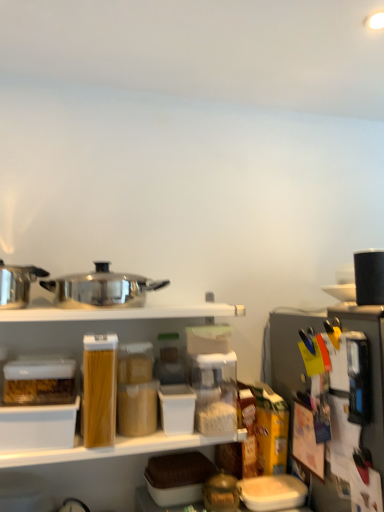
The width and height of the screenshot is (384, 512). What do you see at coordinates (17, 284) in the screenshot?
I see `polished stainless steel pot at left, which ranks as the first appliance in left-to-right order` at bounding box center [17, 284].

Identify the location of metallic silver coffee maker at right, which ranks as the 3th appliance in left-to-right order. (304, 368).

What do you see at coordinates (178, 470) in the screenshot? I see `brown woven basket at center` at bounding box center [178, 470].

At what (x,y) coordinates should I click in order to perform the action: click on polished stainless steel pot at left, marked as the 4th appliance in a right-to-left arrangement. Please return your answer as a coordinate pair (x, y). The width and height of the screenshot is (384, 512). Looking at the image, I should click on (17, 284).

Considering the relative positions of metallic silver coffee maker at right, which ranks as the 3th appliance in left-to-right order, and white plastic shelf at upper center in the image provided, is metallic silver coffee maker at right, which ranks as the 3th appliance in left-to-right order, to the left of white plastic shelf at upper center from the viewer's perspective?

Incorrect, metallic silver coffee maker at right, which ranks as the 3th appliance in left-to-right order, is not on the left side of white plastic shelf at upper center.

Is metallic silver coffee maker at right, the second appliance positioned from the right, not near white plastic shelf at upper center?

No, metallic silver coffee maker at right, the second appliance positioned from the right, is in close proximity to white plastic shelf at upper center.

Is metallic silver coffee maker at right, the second appliance positioned from the right, in front of or behind white plastic shelf at upper center in the image?

Clearly, metallic silver coffee maker at right, the second appliance positioned from the right, is in front of white plastic shelf at upper center.

From the image's perspective, would you say metallic silver coffee maker at right, the second appliance positioned from the right, is positioned over white plastic shelf at upper center?

Incorrect, from the image's perspective, metallic silver coffee maker at right, the second appliance positioned from the right, is lower than white plastic shelf at upper center.

Is point (366, 294) positioned before point (198, 455)?

Yes, point (366, 294) is closer to viewer.

From the image's perspective, which is above, black matte coffee maker at upper right, positioned as the fourth appliance in left-to-right order, or brown woven basket at center?

black matte coffee maker at upper right, positioned as the fourth appliance in left-to-right order.

Is black matte coffee maker at upper right, acting as the first appliance starting from the right, facing towards brown woven basket at center?

No, black matte coffee maker at upper right, acting as the first appliance starting from the right, is not aimed at brown woven basket at center.

Are black matte coffee maker at upper right, acting as the first appliance starting from the right, and brown woven basket at center far apart?

No, black matte coffee maker at upper right, acting as the first appliance starting from the right, is in close proximity to brown woven basket at center.

Visually, is polished stainless steel pot at center, the third appliance in the right-to-left sequence, positioned to the left or to the right of polished stainless steel pot at left, which ranks as the first appliance in left-to-right order?

Clearly, polished stainless steel pot at center, the third appliance in the right-to-left sequence, is on the right of polished stainless steel pot at left, which ranks as the first appliance in left-to-right order, in the image.

From the image's perspective, which appliance is the 1st one below the polished stainless steel pot at left, which ranks as the first appliance in left-to-right order? Please provide its 2D coordinates.

[(101, 288)]

Does point (115, 288) appear closer or farther from the camera than point (6, 302)?

Point (115, 288) is closer to the camera than point (6, 302).

Between polished stainless steel pot at center, positioned as the 2th appliance in left-to-right order, and polished stainless steel pot at left, which ranks as the first appliance in left-to-right order, which one is positioned in front?

polished stainless steel pot at left, which ranks as the first appliance in left-to-right order, is closer to the camera.

Are brown woven basket at center and metallic silver coffee maker at right, the second appliance positioned from the right, beside each other?

No.

Image resolution: width=384 pixels, height=512 pixels. I want to click on the 4th appliance in front of the brown woven basket at center, counting from the anchor's position, so click(304, 368).

Which of these two, polished stainless steel pot at left, which ranks as the first appliance in left-to-right order, or black matte coffee maker at upper right, acting as the first appliance starting from the right, stands shorter?

Standing shorter between the two is polished stainless steel pot at left, which ranks as the first appliance in left-to-right order.

Is polished stainless steel pot at left, marked as the 4th appliance in a right-to-left arrangement, positioned with its back to black matte coffee maker at upper right, acting as the first appliance starting from the right?

No, black matte coffee maker at upper right, acting as the first appliance starting from the right, is not at the back of polished stainless steel pot at left, marked as the 4th appliance in a right-to-left arrangement.

Would you consider polished stainless steel pot at left, which ranks as the first appliance in left-to-right order, to be distant from black matte coffee maker at upper right, acting as the first appliance starting from the right?

Yes, polished stainless steel pot at left, which ranks as the first appliance in left-to-right order, is far from black matte coffee maker at upper right, acting as the first appliance starting from the right.

From a real-world perspective, which object rests below the other?

brown woven basket at center is physically lower.

Which is less distant, (185, 470) or (6, 277)?

Point (185, 470) is closer to the camera than point (6, 277).

Can you confirm if brown woven basket at center is thinner than polished stainless steel pot at left, marked as the 4th appliance in a right-to-left arrangement?

Yes.

Is brown woven basket at center facing away from polished stainless steel pot at left, marked as the 4th appliance in a right-to-left arrangement?

No, brown woven basket at center's orientation is not away from polished stainless steel pot at left, marked as the 4th appliance in a right-to-left arrangement.

Can you confirm if polished stainless steel pot at left, which ranks as the first appliance in left-to-right order, is thinner than white plastic shelf at upper center?

Correct, the width of polished stainless steel pot at left, which ranks as the first appliance in left-to-right order, is less than that of white plastic shelf at upper center.

Which object is positioned more to the right, polished stainless steel pot at left, which ranks as the first appliance in left-to-right order, or white plastic shelf at upper center?

white plastic shelf at upper center is more to the right.

Is polished stainless steel pot at left, marked as the 4th appliance in a right-to-left arrangement, facing towards white plastic shelf at upper center?

No, polished stainless steel pot at left, marked as the 4th appliance in a right-to-left arrangement, is not turned towards white plastic shelf at upper center.

How different are the orientations of polished stainless steel pot at left, marked as the 4th appliance in a right-to-left arrangement, and white plastic shelf at upper center in degrees?

1.96 degrees.

Locate an element on the screen. shelf that is above the metallic silver coffee maker at right, the second appliance positioned from the right (from the image's perspective) is located at coordinates (121, 313).

Which appliance is the 2nd one when counting from the front of the brown woven basket at center? Please provide its 2D coordinates.

[(369, 277)]

Considering their positions, is polished stainless steel pot at center, positioned as the 2th appliance in left-to-right order, positioned closer to brown woven basket at center than black matte coffee maker at upper right, positioned as the fourth appliance in left-to-right order?

The object closer to brown woven basket at center is polished stainless steel pot at center, positioned as the 2th appliance in left-to-right order.

From the picture: Based on their spatial positions, is polished stainless steel pot at left, marked as the 4th appliance in a right-to-left arrangement, or white plastic shelf at upper center further from polished stainless steel pot at center, positioned as the 2th appliance in left-to-right order?

polished stainless steel pot at left, marked as the 4th appliance in a right-to-left arrangement.

Which object lies further to the anchor point metallic silver coffee maker at right, the second appliance positioned from the right, brown woven basket at center or white plastic shelf at upper center?

brown woven basket at center is positioned further to the anchor metallic silver coffee maker at right, the second appliance positioned from the right.

Based on their spatial positions, is white plastic shelf at upper center or brown woven basket at center closer to polished stainless steel pot at center, positioned as the 2th appliance in left-to-right order?

Among the two, white plastic shelf at upper center is located nearer to polished stainless steel pot at center, positioned as the 2th appliance in left-to-right order.

When comparing their distances from polished stainless steel pot at center, positioned as the 2th appliance in left-to-right order, does metallic silver coffee maker at right, which ranks as the 3th appliance in left-to-right order, or polished stainless steel pot at left, marked as the 4th appliance in a right-to-left arrangement, seem closer?

polished stainless steel pot at left, marked as the 4th appliance in a right-to-left arrangement, is closer to polished stainless steel pot at center, positioned as the 2th appliance in left-to-right order.

Estimate the real-world distances between objects in this image. Which object is closer to black matte coffee maker at upper right, acting as the first appliance starting from the right, brown woven basket at center or polished stainless steel pot at center, positioned as the 2th appliance in left-to-right order?

polished stainless steel pot at center, positioned as the 2th appliance in left-to-right order, lies closer to black matte coffee maker at upper right, acting as the first appliance starting from the right, than the other object.

When comparing their distances from black matte coffee maker at upper right, positioned as the fourth appliance in left-to-right order, does polished stainless steel pot at left, marked as the 4th appliance in a right-to-left arrangement, or metallic silver coffee maker at right, the second appliance positioned from the right, seem further?

The object further to black matte coffee maker at upper right, positioned as the fourth appliance in left-to-right order, is polished stainless steel pot at left, marked as the 4th appliance in a right-to-left arrangement.

Estimate the real-world distances between objects in this image. Which object is closer to brown woven basket at center, white plastic shelf at upper center or black matte coffee maker at upper right, positioned as the fourth appliance in left-to-right order?

white plastic shelf at upper center lies closer to brown woven basket at center than the other object.

Where is `food situated between polished stainless steel pot at center, positioned as the 2th appliance in left-to-right order, and black matte coffee maker at upper right, positioned as the fourth appliance in left-to-right order, from left to right`? Image resolution: width=384 pixels, height=512 pixels. food situated between polished stainless steel pot at center, positioned as the 2th appliance in left-to-right order, and black matte coffee maker at upper right, positioned as the fourth appliance in left-to-right order, from left to right is located at coordinates (178, 470).

Where is `appliance situated between white plastic shelf at upper center and metallic silver coffee maker at right, the second appliance positioned from the right, from left to right`? The image size is (384, 512). appliance situated between white plastic shelf at upper center and metallic silver coffee maker at right, the second appliance positioned from the right, from left to right is located at coordinates (101, 288).

Identify the location of shelf between polished stainless steel pot at center, positioned as the 2th appliance in left-to-right order, and brown woven basket at center vertically. click(x=121, y=313).

The image size is (384, 512). In order to click on appliance between polished stainless steel pot at left, which ranks as the first appliance in left-to-right order, and metallic silver coffee maker at right, the second appliance positioned from the right, from left to right in this screenshot , I will do `click(101, 288)`.